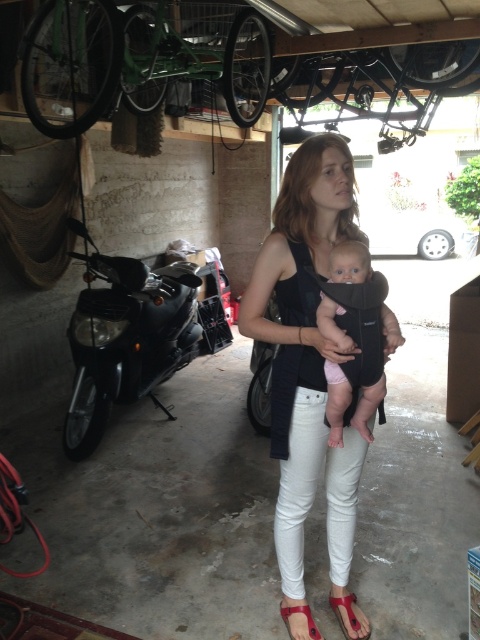
Consider the image. How distant is pink fabric baby at center from matte red sandal at lower center?

A distance of 97.59 centimeters exists between pink fabric baby at center and matte red sandal at lower center.

Which is in front, point (334, 316) or point (333, 598)?

Positioned in front is point (334, 316).

Is point (336, 268) positioned before point (334, 604)?

Yes, point (336, 268) is closer to viewer.

Locate an element on the screen. The width and height of the screenshot is (480, 640). pink fabric baby at center is located at coordinates (336, 401).

Is matte red sandal at lower center taller than red leather sandal at lower center?

Yes.

Measure the distance between point (337, 600) and camera.

The distance of point (337, 600) from camera is 2.00 meters.

Does point (351, 625) come closer to viewer compared to point (294, 609)?

Yes, it is in front of point (294, 609).

I want to click on matte red sandal at lower center, so click(x=348, y=614).

Can you confirm if white matte tank top at center is positioned to the left of matte red sandal at lower center?

Yes, white matte tank top at center is to the left of matte red sandal at lower center.

Is point (271, 289) closer to camera compared to point (336, 612)?

Yes, point (271, 289) is closer to viewer.

Does point (304, 486) lie in front of point (350, 595)?

Yes, it is in front of point (350, 595).

The height and width of the screenshot is (640, 480). Find the location of `white matte tank top at center`. white matte tank top at center is located at coordinates (307, 356).